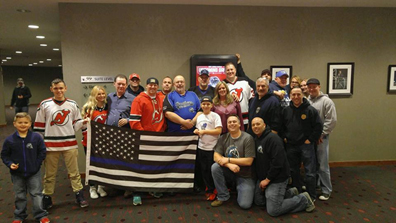
Find the location of a particular element. Image resolution: width=396 pixels, height=223 pixels. walls is located at coordinates tap(146, 36), tap(39, 85).